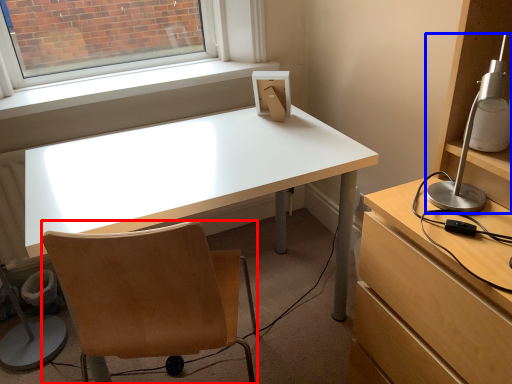
Question: Which object appears farthest to the camera in this image, chair (highlighted by a red box) or lamp (highlighted by a blue box)?

Choices:
 (A) chair
 (B) lamp

Answer: (A)